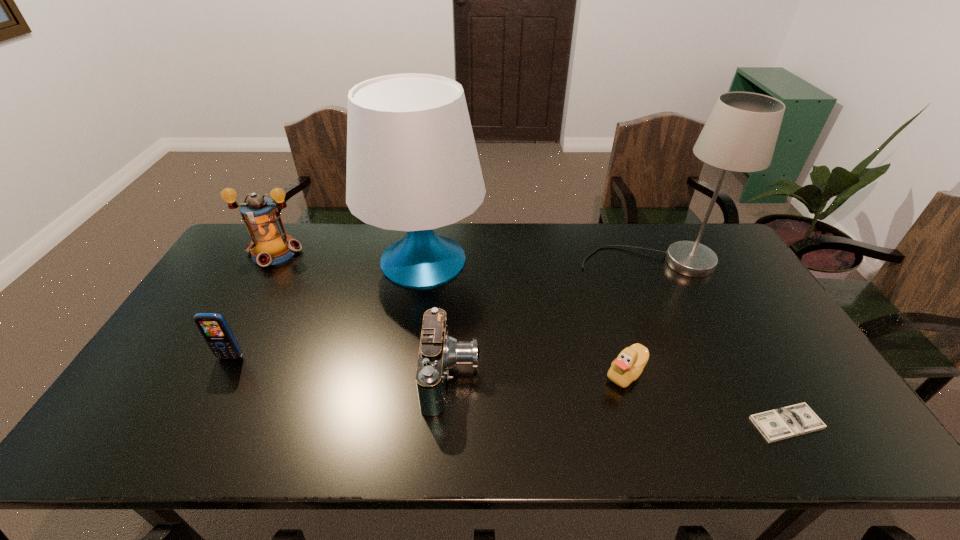
Find the location of a particular element. This screenshot has height=540, width=960. the left table lamp is located at coordinates (412, 165).

The width and height of the screenshot is (960, 540). Identify the location of the right table lamp. tap(740, 135).

This screenshot has height=540, width=960. I want to click on lantern, so click(270, 244).

Identify the location of cellular telephone. Image resolution: width=960 pixels, height=540 pixels. (213, 327).

This screenshot has width=960, height=540. I want to click on camcorder, so click(x=439, y=352).

Image resolution: width=960 pixels, height=540 pixels. I want to click on duck, so click(x=627, y=367).

This screenshot has height=540, width=960. I want to click on the shortest object, so click(x=778, y=424).

Locate an element on the screen. vacant point located on the front-facing side of the left table lamp is located at coordinates (544, 259).

Locate an element on the screen. Image resolution: width=960 pixels, height=540 pixels. vacant space located on the front of the right table lamp is located at coordinates (668, 302).

The height and width of the screenshot is (540, 960). What are the coordinates of `vacant position located 0.190m on the front-facing side of the lantern` in the screenshot? It's located at (241, 310).